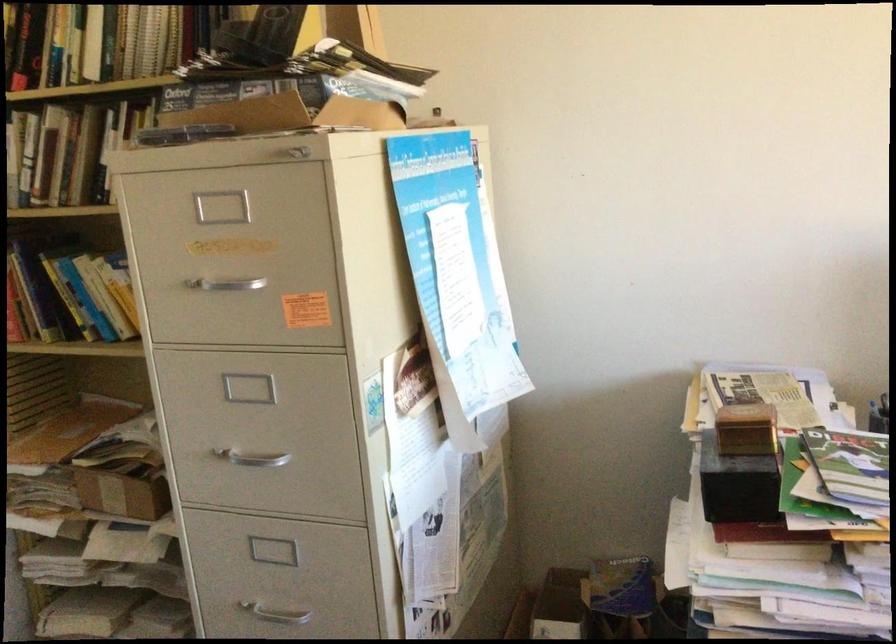
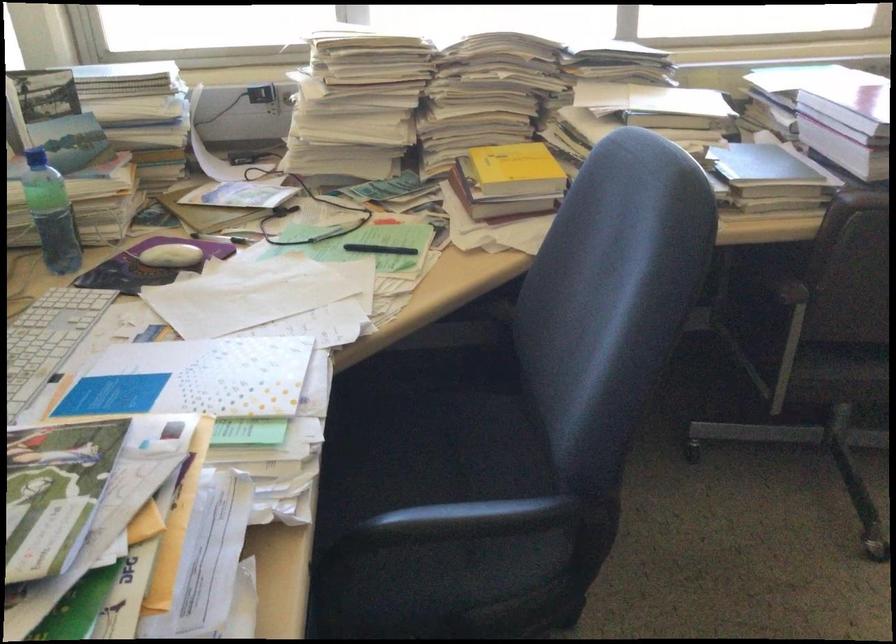
In the scene shown: The images are taken continuously from a first-person perspective. In which direction is your viewpoint rotating?

The camera's rotation is toward right-down.